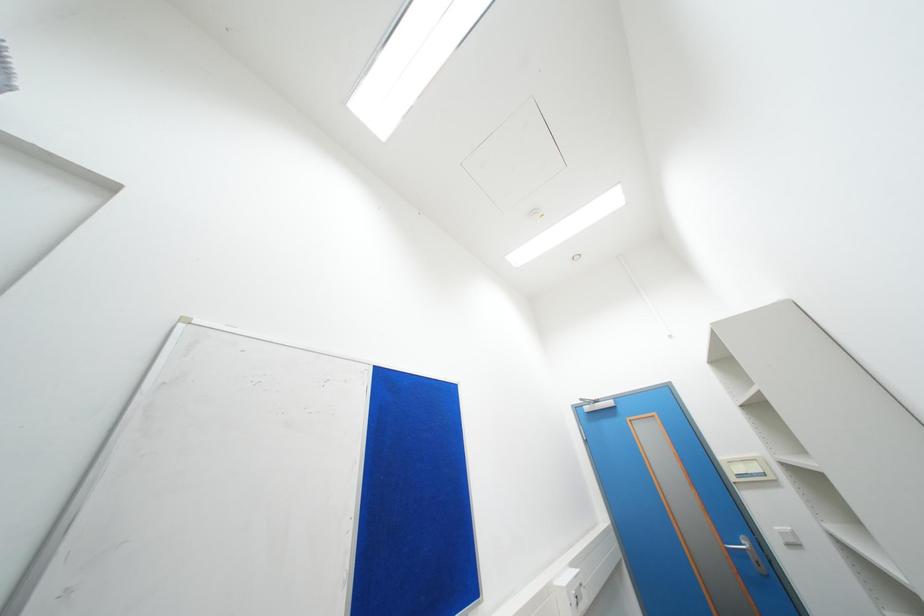
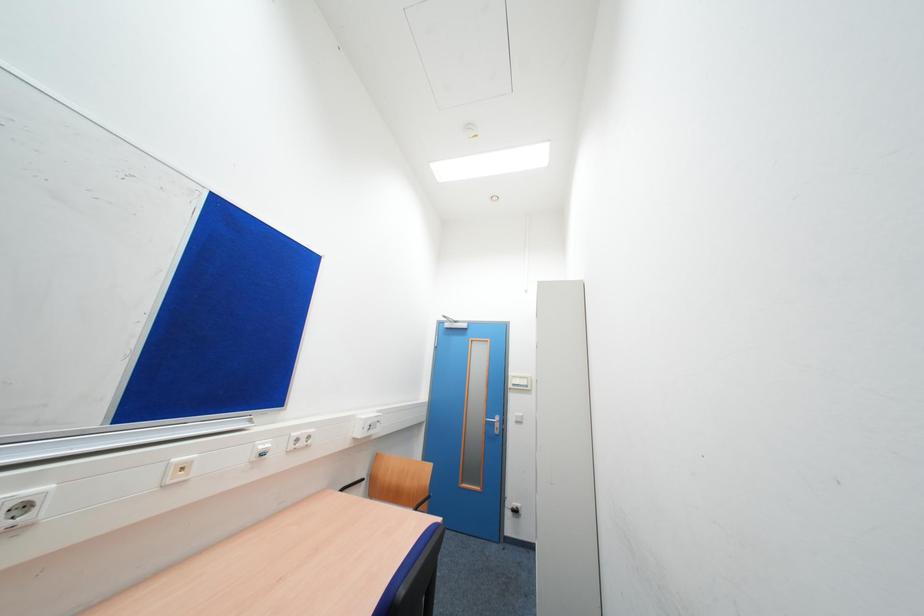
Question: The images are taken continuously from a first-person perspective. In which direction is your viewpoint rotating?

Choices:
 (A) Left
 (B) Right
 (C) Up
 (D) Down

Answer: (B)